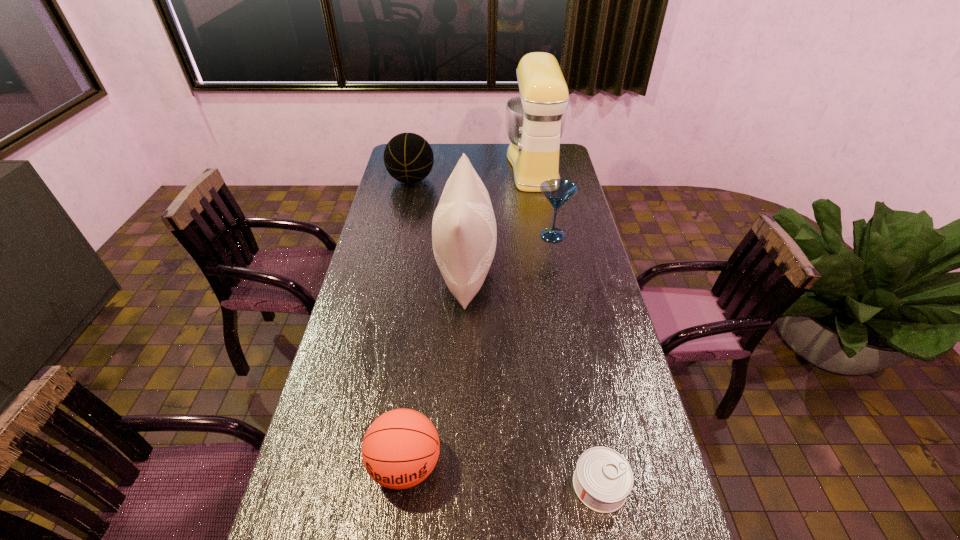
You are a GUI agent. You are given a task and a screenshot of the screen. Output one action in this format:
    pyautogui.click(x=<x>, y=<y>)
    Task: Click on the mixer
    
    Given the screenshot: What is the action you would take?
    pyautogui.click(x=535, y=120)

I want to click on the fifth shortest object, so click(464, 233).

The height and width of the screenshot is (540, 960). What are the coordinates of `the taller basketball` in the screenshot? It's located at (408, 157).

Locate an element on the screen. martini is located at coordinates (557, 191).

Locate an element on the screen. The height and width of the screenshot is (540, 960). the second shortest object is located at coordinates (400, 449).

The width and height of the screenshot is (960, 540). I want to click on the shorter basketball, so click(400, 449).

You are a GUI agent. You are given a task and a screenshot of the screen. Output one action in this format:
    pyautogui.click(x=<x>, y=<y>)
    Task: Click on the shortest object
    This screenshot has width=960, height=540.
    Given the screenshot: What is the action you would take?
    pos(603,479)

This screenshot has width=960, height=540. Identify the location of free location located 0.210m on the side of the mixer with the control knob. (462, 166).

At what (x,y) coordinates should I click in order to perform the action: click on vacant space located 0.150m on the side of the mixer with the control knob. Please return your answer as a coordinate pair (x, y). Looking at the image, I should click on click(474, 166).

Identify the location of free spot located on the side of the mixer with the control knob. The image size is (960, 540). (433, 166).